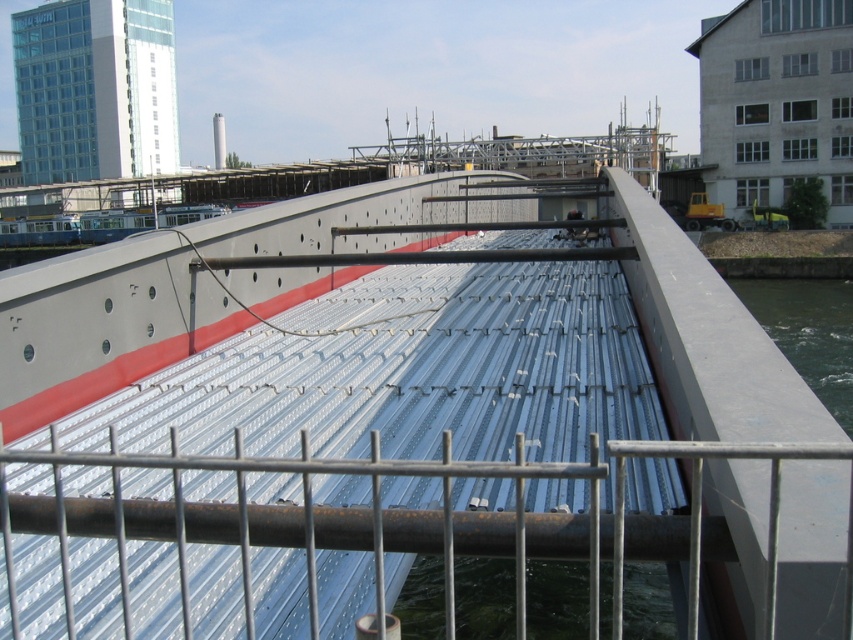
Can you confirm if metallic silver boat at center is thinner than silver metallic rail at center?

Incorrect, metallic silver boat at center's width is not less than silver metallic rail at center's.

Is metallic silver boat at center wider than silver metallic rail at center?

Correct, the width of metallic silver boat at center exceeds that of silver metallic rail at center.

At what (x,y) coordinates should I click in order to perform the action: click on metallic silver boat at center. Please return your answer as a coordinate pair (x, y). Image resolution: width=853 pixels, height=640 pixels. Looking at the image, I should click on (399, 424).

Where is `metallic silver boat at center`? The height and width of the screenshot is (640, 853). metallic silver boat at center is located at coordinates 399,424.

Is silver metallic rail at center below clear water at right?

Indeed, silver metallic rail at center is positioned under clear water at right.

Does silver metallic rail at center have a greater height compared to clear water at right?

No, silver metallic rail at center is not taller than clear water at right.

Is point (682, 538) positioned before point (820, 388)?

Yes, it is.

Locate an element on the screen. silver metallic rail at center is located at coordinates (399, 518).

Is point (541, 435) in front of point (846, 397)?

Yes, point (541, 435) is in front of point (846, 397).

Between point (752, 365) and point (842, 317), which one is positioned behind?

Point (842, 317)

Does point (712, 422) come farther from viewer compared to point (845, 298)?

That is False.

Locate an element on the screen. Image resolution: width=853 pixels, height=640 pixels. metallic silver boat at center is located at coordinates (399, 424).